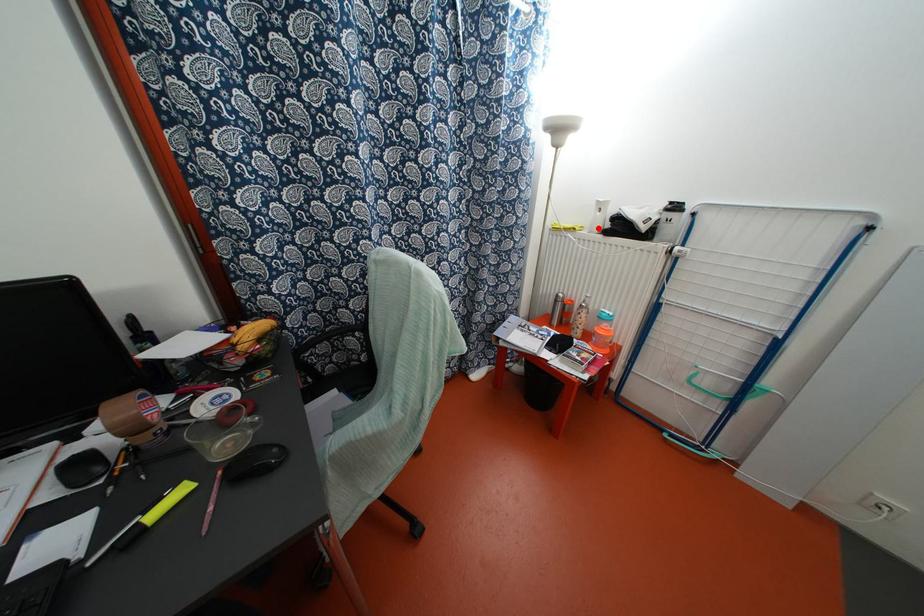
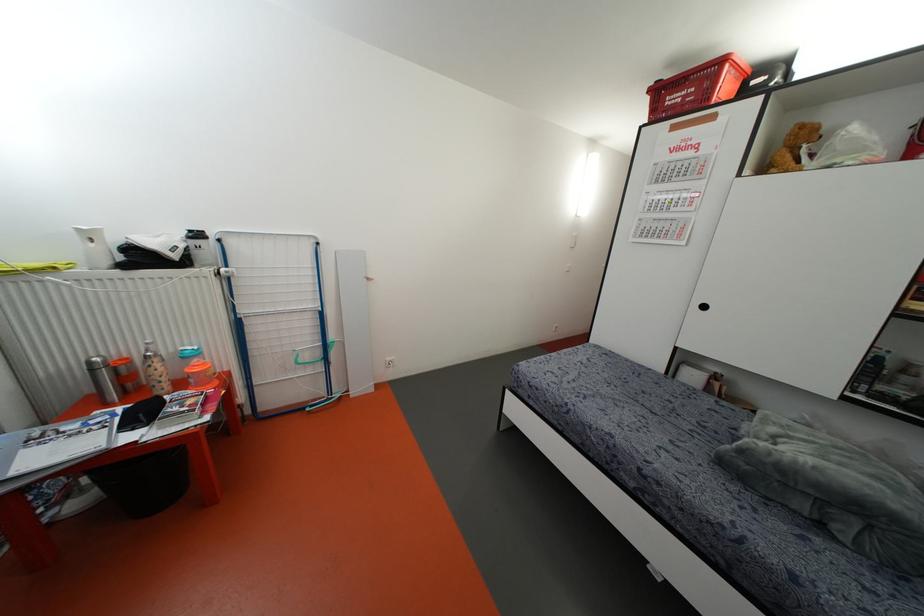
In the second image, find the point that corresponds to the highlighted location in the first image.

(107, 262)